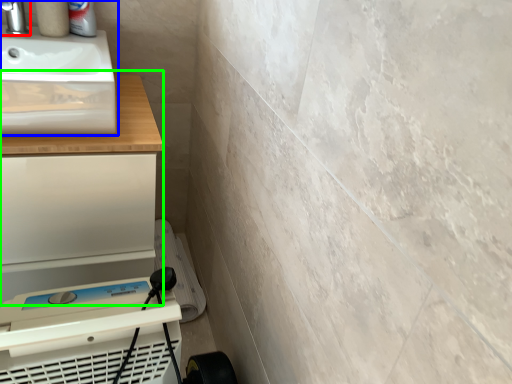
Question: Which is nearer to the tap (highlighted by a red box)? sink (highlighted by a blue box) or counter (highlighted by a green box).

Choices:
 (A) sink
 (B) counter

Answer: (A)